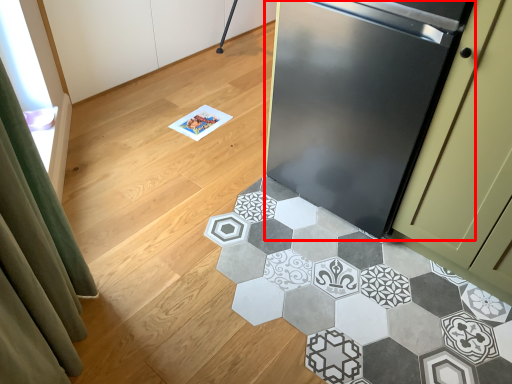
Question: Where is refrigerator (annotated by the red box) located in relation to marble in the image?

Choices:
 (A) right
 (B) left

Answer: (A)